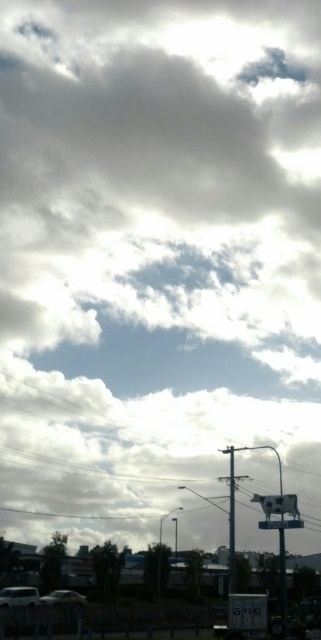
Looking at this image, how distant is silver metallic car at lower left from white plastic sign at center?

18.66 meters

In the scene shown: Who is more forward, (52, 592) or (268, 522)?

Point (268, 522) is in front.

Is point (67, 589) behind point (303, 524)?

Yes.

Find the location of a particular element. The width and height of the screenshot is (321, 640). silver metallic car at lower left is located at coordinates (61, 596).

The image size is (321, 640). What do you see at coordinates (232, 524) in the screenshot?
I see `metallic pole at center` at bounding box center [232, 524].

I want to click on metallic pole at center, so click(232, 524).

Does white matte car at lower left appear under silver metallic car at lower left?

Actually, white matte car at lower left is above silver metallic car at lower left.

Which is in front, point (27, 588) or point (53, 595)?

Point (27, 588) is in front.

Does point (8, 600) come farther from viewer compared to point (62, 598)?

No, it is in front of (62, 598).

The width and height of the screenshot is (321, 640). Identify the location of white matte car at lower left. (18, 596).